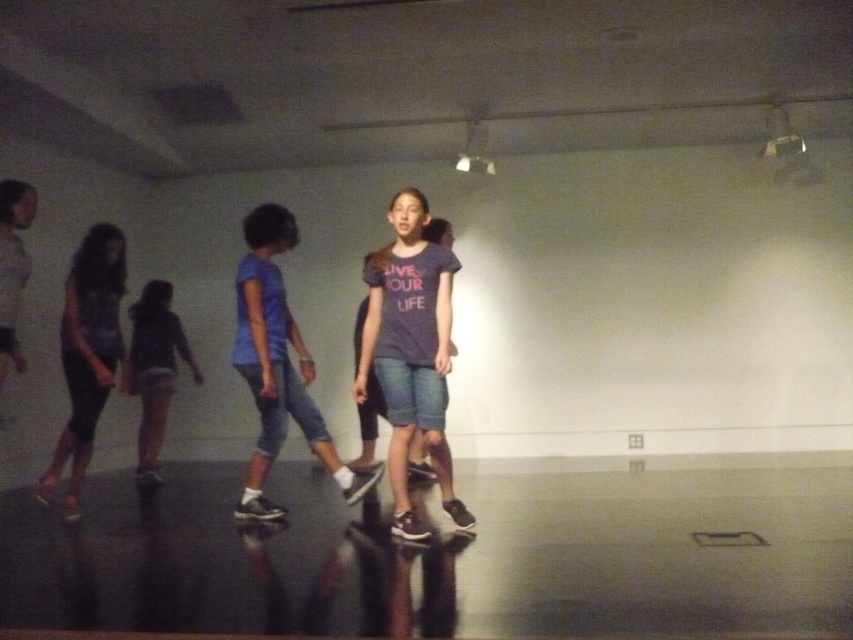
Question: Is denim shorts at center to the right of matte black leggings at left from the viewer's perspective?

Choices:
 (A) yes
 (B) no

Answer: (A)

Question: Among these points, which one is farthest from the camera?

Choices:
 (A) (102, 298)
 (B) (396, 518)
 (C) (154, 308)

Answer: (C)

Question: Where is blue fabric shirt at center located in relation to matte black leggings at left in the image?

Choices:
 (A) below
 (B) above

Answer: (B)

Question: Which of these objects is positioned farthest from the denim shorts at center?

Choices:
 (A) blue fabric shirt at center
 (B) light purple fabric shorts at center

Answer: (B)

Question: Can you confirm if denim shorts at center is thinner than blue fabric shirt at center?

Choices:
 (A) yes
 (B) no

Answer: (A)

Question: Which object is closer to the camera taking this photo?

Choices:
 (A) blue fabric shirt at center
 (B) matte black leggings at left
 (C) light purple fabric shorts at center

Answer: (A)